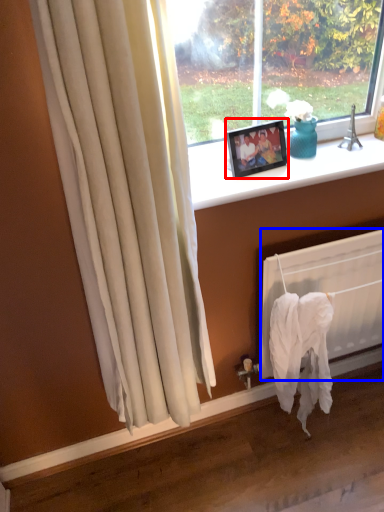
Question: Which point is closer to the camera, picture frame (highlighted by a red box) or radiator (highlighted by a blue box)?

Choices:
 (A) picture frame
 (B) radiator

Answer: (A)